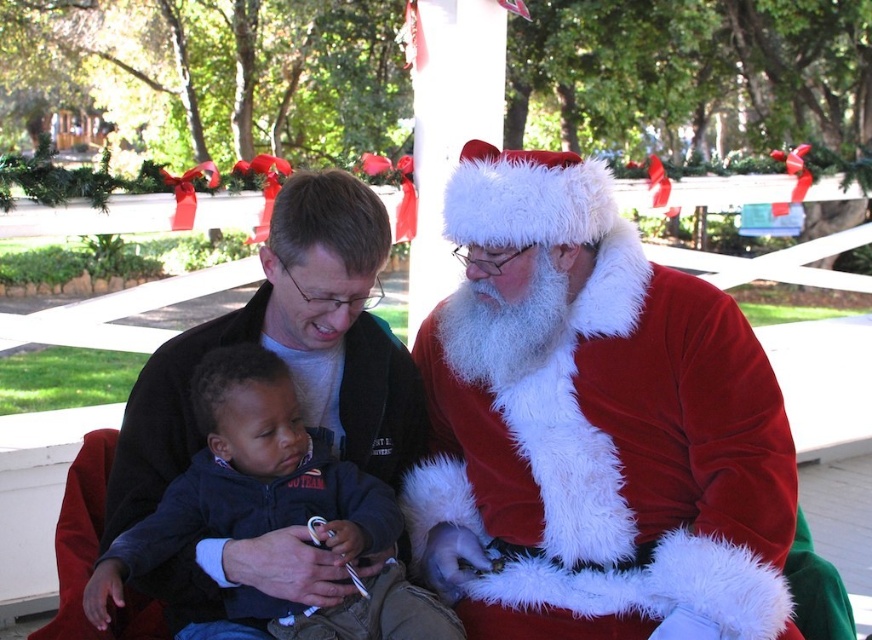
Is the position of velvet santa claus at center more distant than that of matte black jacket at center?

Yes.

Does velvet santa claus at center have a smaller size compared to matte black jacket at center?

Actually, velvet santa claus at center might be larger than matte black jacket at center.

Is point (537, 484) positioned before point (228, 637)?

No, (537, 484) is further to viewer.

Locate an element on the screen. The height and width of the screenshot is (640, 872). velvet santa claus at center is located at coordinates (593, 426).